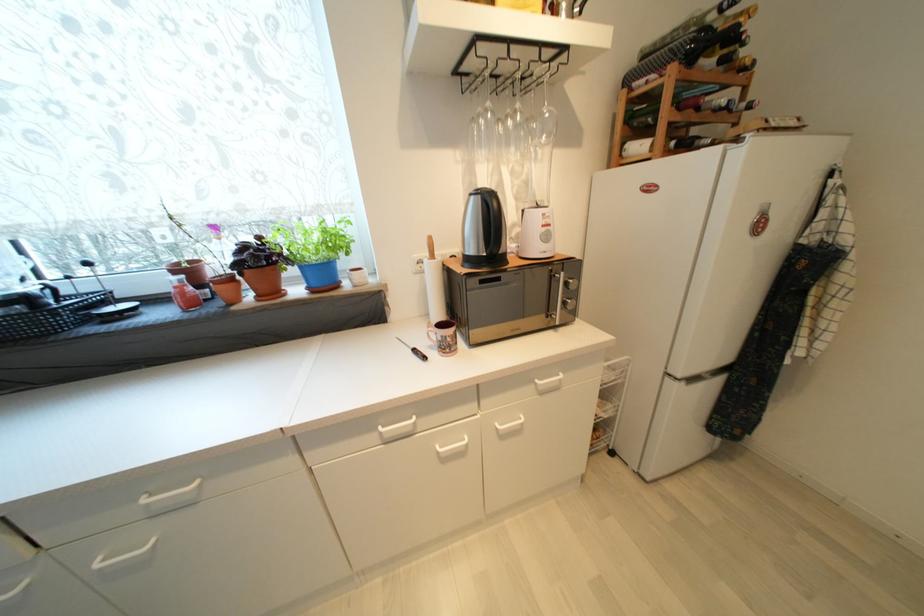
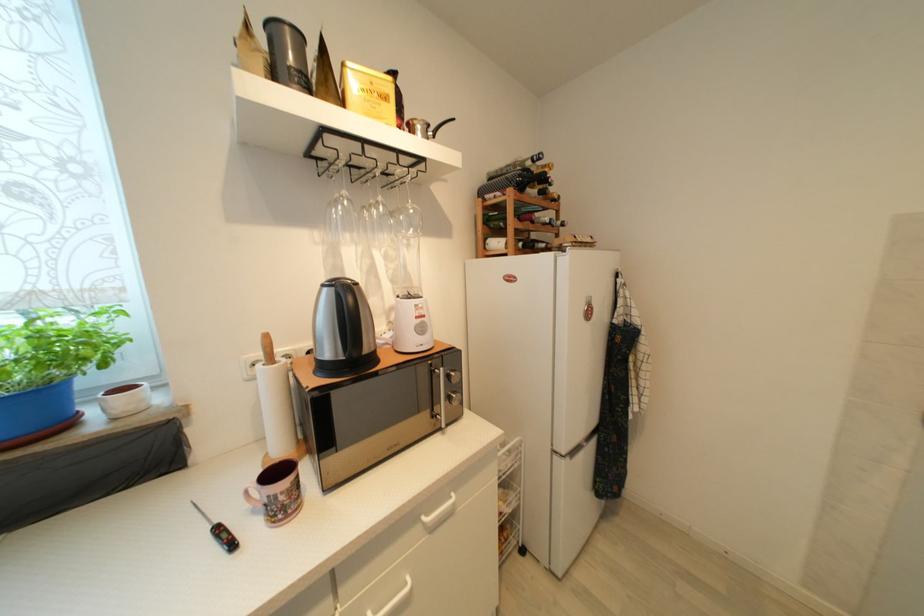
Where in the second image is the point corresponding to point 541,383 from the first image?

(429, 521)